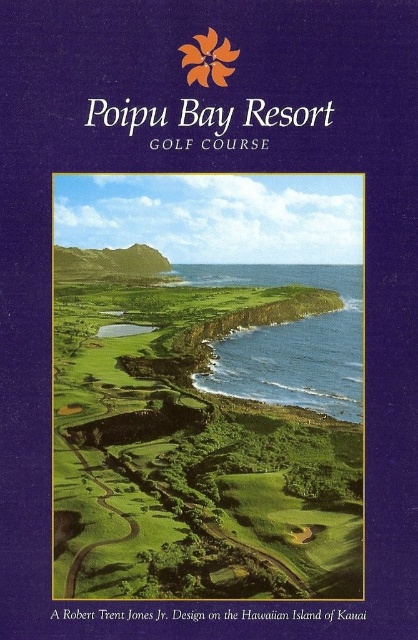
You are a golfer standing at the tee box. You need to hit your ball over both the green grassy golf course at center and the blue water at center. Which object will require a higher trajectory to clear?

The blue water at center requires a higher trajectory to clear because the green grassy golf course at center is shorter than it.